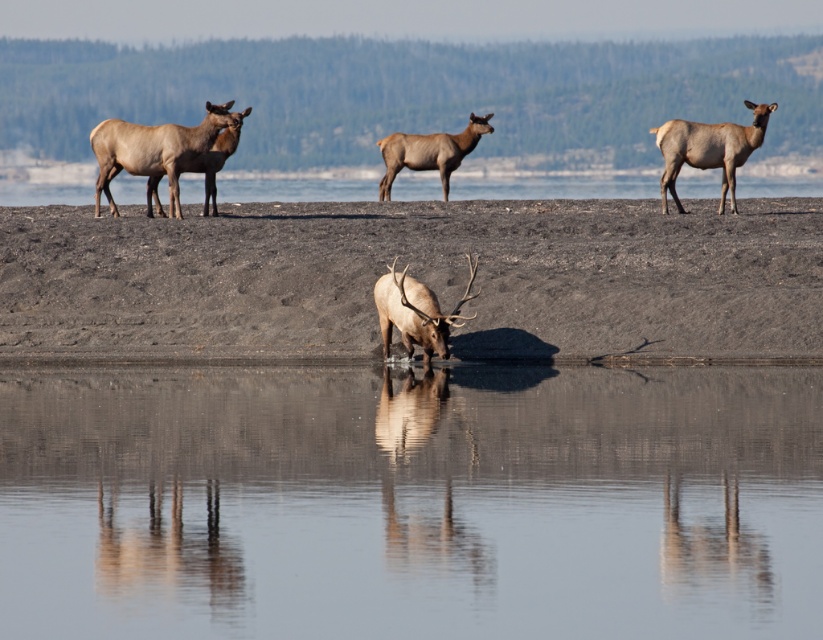
Question: Which point appears farthest from the camera in this image?

Choices:
 (A) (468, 144)
 (B) (67, 237)
 (C) (422, 314)
 (D) (189, 168)

Answer: (A)

Question: Which object is the closest to the brown velvet deer at upper right?

Choices:
 (A) clear water at center
 (B) brown velvet antlers at upper left

Answer: (B)

Question: Can you confirm if clear water at center is positioned above brown velvet antlers at upper left?

Choices:
 (A) no
 (B) yes

Answer: (A)

Question: Which point appears closest to the camera in this image?

Choices:
 (A) (393, 132)
 (B) (700, 150)
 (C) (574, 540)
 (D) (456, 326)

Answer: (C)

Question: Can you confirm if dull brown dirt at center is thinner than brown velvet antlers at upper left?

Choices:
 (A) yes
 (B) no

Answer: (B)

Question: Is clear water at center above dull brown dirt at center?

Choices:
 (A) no
 (B) yes

Answer: (A)